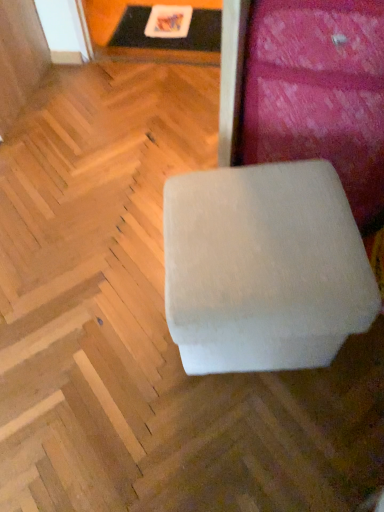
The width and height of the screenshot is (384, 512). What do you see at coordinates (263, 268) in the screenshot?
I see `white fabric ottoman at center, which appears as the 1th furniture when ordered from the bottom` at bounding box center [263, 268].

What do you see at coordinates (169, 28) in the screenshot? This screenshot has height=512, width=384. I see `white plastic tray at upper center` at bounding box center [169, 28].

Locate an element on the screen. The width and height of the screenshot is (384, 512). white fabric ottoman at center, which appears as the 1th furniture when ordered from the bottom is located at coordinates (263, 268).

How different are the orientations of white fabric ottoman at center, which appears as the 1th furniture when ordered from the bottom, and white fabric ottoman at center, arranged as the first furniture when viewed from the top, in degrees?

The angular difference between white fabric ottoman at center, which appears as the 1th furniture when ordered from the bottom, and white fabric ottoman at center, arranged as the first furniture when viewed from the top, is 70.7 degrees.

Which object is thinner, white fabric ottoman at center, which appears as the 1th furniture when ordered from the bottom, or white fabric ottoman at center, acting as the second furniture starting from the bottom?

Thinner between the two is white fabric ottoman at center, acting as the second furniture starting from the bottom.

Would you say white fabric ottoman at center, which appears as the 1th furniture when ordered from the bottom, is a long distance from white fabric ottoman at center, arranged as the first furniture when viewed from the top?

white fabric ottoman at center, which appears as the 1th furniture when ordered from the bottom, is near white fabric ottoman at center, arranged as the first furniture when viewed from the top, not far away.

Is point (318, 221) positioned before point (335, 61)?

Yes, point (318, 221) is closer to viewer.

Is white fabric ottoman at center, arranged as the first furniture when viewed from the top, wider than white fabric ottoman at center, which appears as the 1th furniture when ordered from the bottom?

No, white fabric ottoman at center, arranged as the first furniture when viewed from the top, is not wider than white fabric ottoman at center, which appears as the 1th furniture when ordered from the bottom.

Can you confirm if white fabric ottoman at center, arranged as the first furniture when viewed from the top, is taller than white fabric ottoman at center, which appears as the 2th furniture when viewed from the top?

Indeed, white fabric ottoman at center, arranged as the first furniture when viewed from the top, has a greater height compared to white fabric ottoman at center, which appears as the 2th furniture when viewed from the top.

Considering the relative positions of white fabric ottoman at center, acting as the second furniture starting from the bottom, and white fabric ottoman at center, which appears as the 2th furniture when viewed from the top, in the image provided, is white fabric ottoman at center, acting as the second furniture starting from the bottom, to the left or to the right of white fabric ottoman at center, which appears as the 2th furniture when viewed from the top,?

Answer: Clearly, white fabric ottoman at center, acting as the second furniture starting from the bottom, is on the right of white fabric ottoman at center, which appears as the 2th furniture when viewed from the top, in the image.

From the image's perspective, is white plastic tray at upper center located above or below white fabric ottoman at center, arranged as the first furniture when viewed from the top?

white plastic tray at upper center is situated higher than white fabric ottoman at center, arranged as the first furniture when viewed from the top, in the image.

Is white plastic tray at upper center situated inside white fabric ottoman at center, arranged as the first furniture when viewed from the top, or outside?

white plastic tray at upper center exists outside the volume of white fabric ottoman at center, arranged as the first furniture when viewed from the top.

Does white plastic tray at upper center have a lesser width compared to white fabric ottoman at center, arranged as the first furniture when viewed from the top?

No.

Is white plastic tray at upper center far away from white fabric ottoman at center, arranged as the first furniture when viewed from the top?

Absolutely, white plastic tray at upper center is distant from white fabric ottoman at center, arranged as the first furniture when viewed from the top.

Between point (192, 306) and point (193, 40), which one is positioned in front?

The point (192, 306) is closer to the camera.

Which of these two, white fabric ottoman at center, which appears as the 1th furniture when ordered from the bottom, or white plastic tray at upper center, is wider?

Wider between the two is white plastic tray at upper center.

Is white fabric ottoman at center, which appears as the 2th furniture when viewed from the top, bigger than white plastic tray at upper center?

Yes.

From the image's perspective, between white fabric ottoman at center, which appears as the 1th furniture when ordered from the bottom, and white plastic tray at upper center, who is located below?

white fabric ottoman at center, which appears as the 1th furniture when ordered from the bottom.

Would you say white plastic tray at upper center is to the left or to the right of white fabric ottoman at center, which appears as the 1th furniture when ordered from the bottom, in the picture?

In the image, white plastic tray at upper center appears on the left side of white fabric ottoman at center, which appears as the 1th furniture when ordered from the bottom.

Would you say white plastic tray at upper center is outside white fabric ottoman at center, which appears as the 1th furniture when ordered from the bottom?

That's correct, white plastic tray at upper center is outside of white fabric ottoman at center, which appears as the 1th furniture when ordered from the bottom.

Can you see white plastic tray at upper center touching white fabric ottoman at center, which appears as the 2th furniture when viewed from the top?

white plastic tray at upper center is not next to white fabric ottoman at center, which appears as the 2th furniture when viewed from the top, and they're not touching.

Measure the distance from white fabric ottoman at center, arranged as the first furniture when viewed from the top, to white plastic tray at upper center.

A distance of 1.15 meters exists between white fabric ottoman at center, arranged as the first furniture when viewed from the top, and white plastic tray at upper center.

Between white fabric ottoman at center, acting as the second furniture starting from the bottom, and white plastic tray at upper center, which one appears on the right side from the viewer's perspective?

From the viewer's perspective, white fabric ottoman at center, acting as the second furniture starting from the bottom, appears more on the right side.

Is white fabric ottoman at center, acting as the second furniture starting from the bottom, facing away from white plastic tray at upper center?

white fabric ottoman at center, acting as the second furniture starting from the bottom, does not have its back to white plastic tray at upper center.

Considering the sizes of objects white fabric ottoman at center, arranged as the first furniture when viewed from the top, and white plastic tray at upper center in the image provided, who is smaller, white fabric ottoman at center, arranged as the first furniture when viewed from the top, or white plastic tray at upper center?

Smaller between the two is white plastic tray at upper center.

Image resolution: width=384 pixels, height=512 pixels. I want to click on furniture below the white fabric ottoman at center, arranged as the first furniture when viewed from the top (from the image's perspective), so click(x=263, y=268).

The image size is (384, 512). What are the coordinates of `furniture behind the white fabric ottoman at center, which appears as the 2th furniture when viewed from the top` in the screenshot? It's located at (312, 92).

Which object lies nearer to the anchor point white fabric ottoman at center, arranged as the first furniture when viewed from the top, white fabric ottoman at center, which appears as the 2th furniture when viewed from the top, or white plastic tray at upper center?

white fabric ottoman at center, which appears as the 2th furniture when viewed from the top, is positioned closer to the anchor white fabric ottoman at center, arranged as the first furniture when viewed from the top.

In the scene shown: When comparing their distances from white fabric ottoman at center, acting as the second furniture starting from the bottom, does white plastic tray at upper center or white fabric ottoman at center, which appears as the 1th furniture when ordered from the bottom, seem further?

white plastic tray at upper center is further to white fabric ottoman at center, acting as the second furniture starting from the bottom.

Which object lies further to the anchor point white fabric ottoman at center, which appears as the 2th furniture when viewed from the top, white fabric ottoman at center, arranged as the first furniture when viewed from the top, or white plastic tray at upper center?

white plastic tray at upper center is positioned further to the anchor white fabric ottoman at center, which appears as the 2th furniture when viewed from the top.

Which object lies further to the anchor point white plastic tray at upper center, white fabric ottoman at center, arranged as the first furniture when viewed from the top, or white fabric ottoman at center, which appears as the 2th furniture when viewed from the top?

Based on the image, white fabric ottoman at center, which appears as the 2th furniture when viewed from the top, appears to be further to white plastic tray at upper center.

Looking at this image, looking at the image, which one is located further to white plastic tray at upper center, white fabric ottoman at center, which appears as the 1th furniture when ordered from the bottom, or white fabric ottoman at center, arranged as the first furniture when viewed from the top?

Among the two, white fabric ottoman at center, which appears as the 1th furniture when ordered from the bottom, is located further to white plastic tray at upper center.

Which object lies nearer to the anchor point white fabric ottoman at center, which appears as the 2th furniture when viewed from the top, white plastic tray at upper center or white fabric ottoman at center, arranged as the first furniture when viewed from the top?

The object closer to white fabric ottoman at center, which appears as the 2th furniture when viewed from the top, is white fabric ottoman at center, arranged as the first furniture when viewed from the top.

You are a GUI agent. You are given a task and a screenshot of the screen. Output one action in this format:
    pyautogui.click(x=<x>, y=<y>)
    Task: Click on the furniture positioned between white fabric ottoman at center, which appears as the 1th furniture when ordered from the bottom, and white plastic tray at upper center from near to far
    
    Given the screenshot: What is the action you would take?
    pyautogui.click(x=312, y=92)